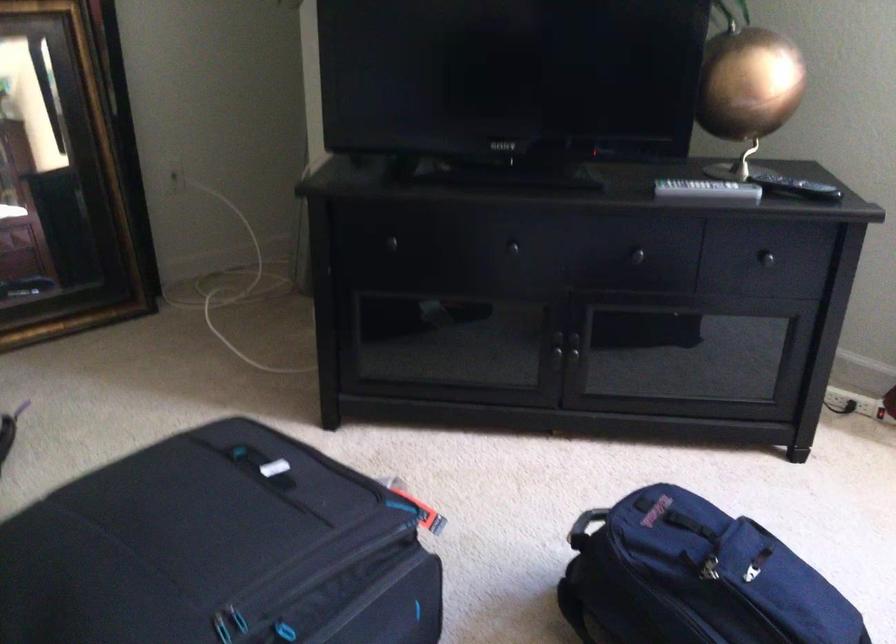
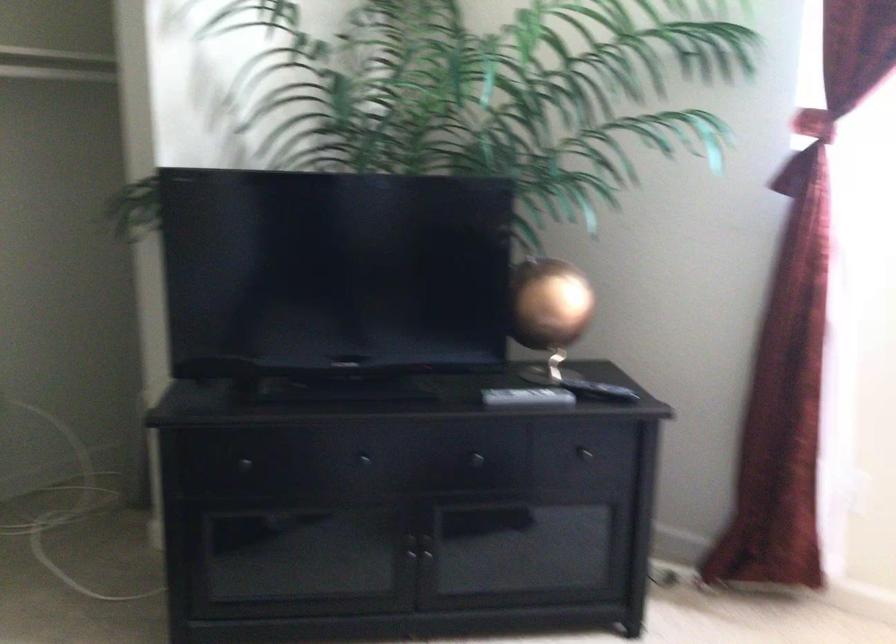
The point at (x=557, y=346) is marked in the first image. Where is the corresponding point in the second image?

(410, 547)